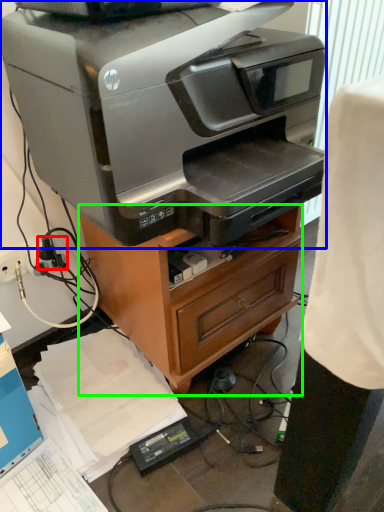
Question: Which object is positioned farthest from plug (highlighted by a red box)? Select from printer (highlighted by a blue box) and furniture (highlighted by a green box).

Choices:
 (A) printer
 (B) furniture

Answer: (A)